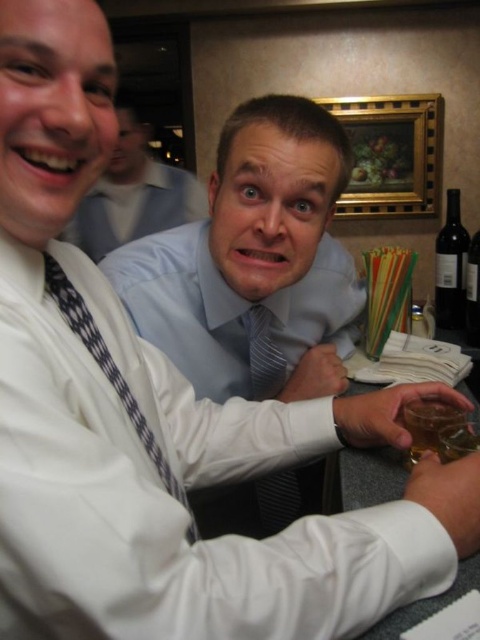
You are at a social event and want to take a photo of both individuals. The first person is at point (197,195) and the second is at point (144,436). Which individual is closer to the camera so they can be in focus?

Point (197,195) is further to the viewer than point (144,436), so the first individual at point (197,195) is closer to the camera and will be in focus first.

You are taking a photo of the two points in the scene. Which point, point (257, 385) or point (445, 276), will appear larger in the photo?

Point (257, 385) will appear larger in the photo because it is closer to the camera than point (445, 276).

Where is the striped fabric tie at center located in the image?

The striped fabric tie at center is located at point (x=264, y=355) in the image.